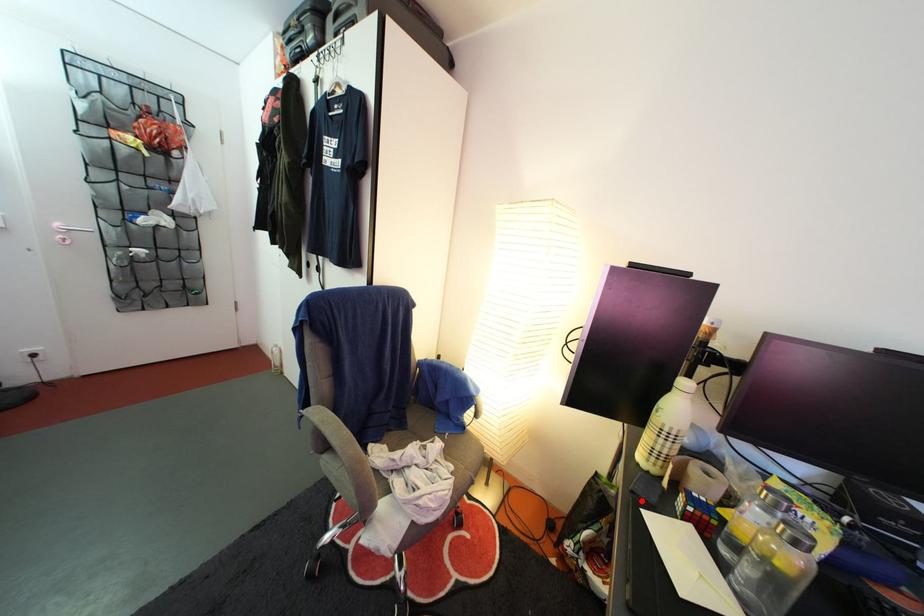
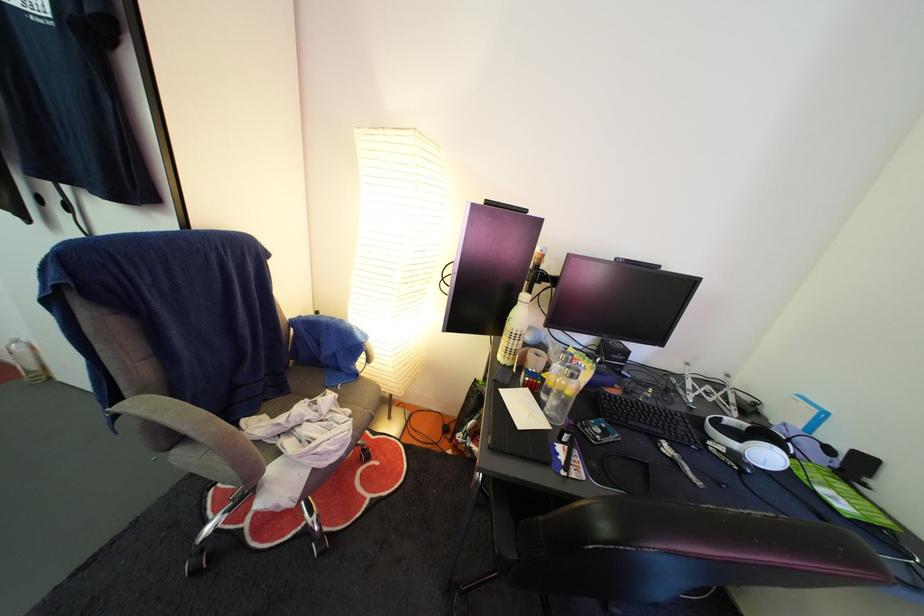
Locate, in the second image, the point that corresponds to the highlighted location in the first image.

(504, 389)